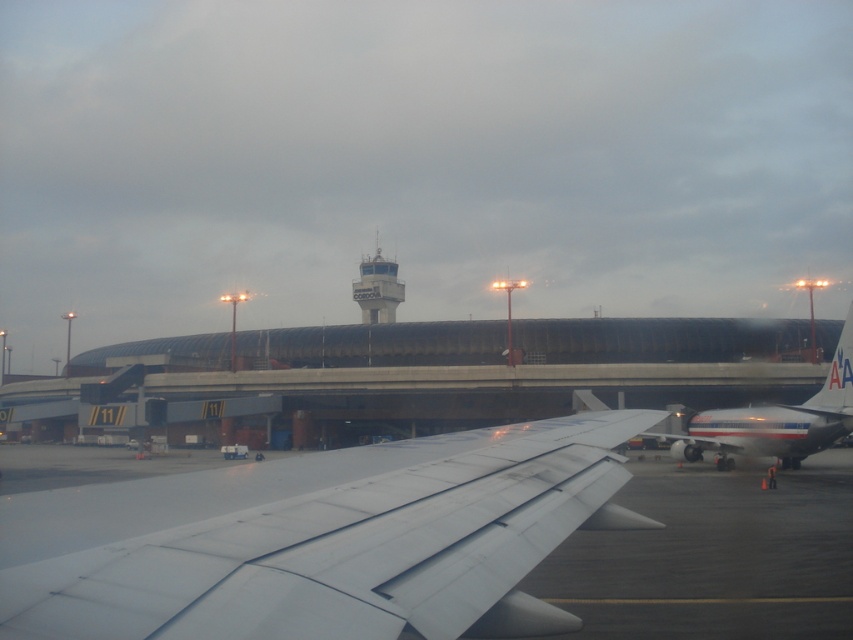
Question: Is white matte wing at center above white concrete control tower at center?

Choices:
 (A) yes
 (B) no

Answer: (B)

Question: Is white glossy airplane at right above white concrete control tower at center?

Choices:
 (A) no
 (B) yes

Answer: (A)

Question: Which is nearer to the white concrete control tower at center?

Choices:
 (A) white matte wing at center
 (B) white glossy airplane at right

Answer: (B)

Question: Which point is farther from the camera taking this photo?

Choices:
 (A) (833, 410)
 (B) (222, 618)

Answer: (A)

Question: Is white matte wing at center smaller than white glossy airplane at right?

Choices:
 (A) no
 (B) yes

Answer: (B)

Question: Estimate the real-world distances between objects in this image. Which object is closer to the white concrete control tower at center?

Choices:
 (A) white glossy airplane at right
 (B) white matte wing at center

Answer: (A)